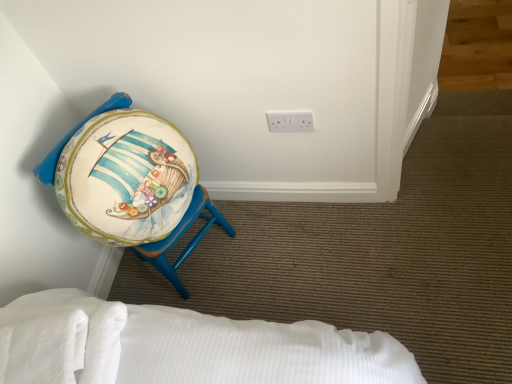
Where is `vacant space underneath matte painted stool at left (from a real-world perspective)`? Image resolution: width=512 pixels, height=384 pixels. vacant space underneath matte painted stool at left (from a real-world perspective) is located at coordinates (197, 260).